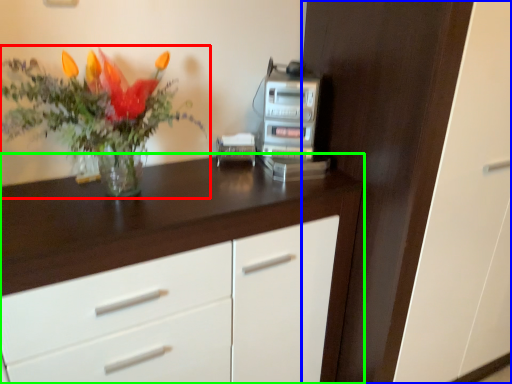
Question: Which object is positioned farthest from houseplant (highlighted by a red box)? Select from dresser (highlighted by a blue box) and chest of drawers (highlighted by a green box).

Choices:
 (A) dresser
 (B) chest of drawers

Answer: (A)